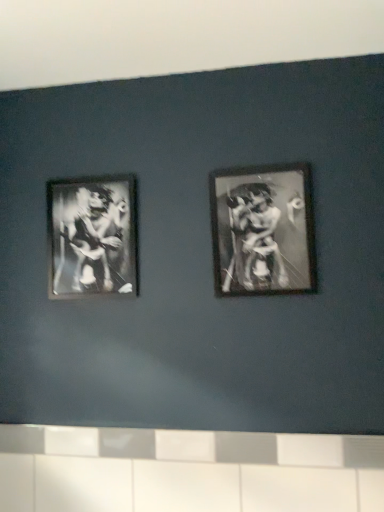
Question: Considering the relative positions of metallic silver frame at left, positioned as the 2th picture frame in right-to-left order, and white glossy tile at lower center in the image provided, is metallic silver frame at left, positioned as the 2th picture frame in right-to-left order, to the left of white glossy tile at lower center from the viewer's perspective?

Choices:
 (A) no
 (B) yes

Answer: (B)

Question: Is metallic silver frame at left, positioned as the 2th picture frame in right-to-left order, touching white glossy tile at lower center?

Choices:
 (A) no
 (B) yes

Answer: (A)

Question: Does metallic silver frame at left, which is the 2th picture frame from front to back, come in front of white glossy tile at lower center?

Choices:
 (A) yes
 (B) no

Answer: (B)

Question: From the image's perspective, is metallic silver frame at left, which appears as the first picture frame when viewed from the back, over white glossy tile at lower center?

Choices:
 (A) yes
 (B) no

Answer: (A)

Question: From a real-world perspective, is metallic silver frame at left, which appears as the first picture frame when viewed from the back, below white glossy tile at lower center?

Choices:
 (A) yes
 (B) no

Answer: (B)

Question: Does metallic silver frame at left, which is the 2th picture frame from front to back, turn towards white glossy tile at lower center?

Choices:
 (A) yes
 (B) no

Answer: (B)

Question: Can you confirm if metallic silver frame at center right, the 2th picture frame viewed from the left, is taller than white glossy tile at lower center?

Choices:
 (A) no
 (B) yes

Answer: (B)

Question: Is metallic silver frame at center right, the 2th picture frame viewed from the left, closer to the viewer compared to white glossy tile at lower center?

Choices:
 (A) yes
 (B) no

Answer: (B)

Question: Is metallic silver frame at center right, which ranks as the 2th picture frame in back-to-front order, located outside white glossy tile at lower center?

Choices:
 (A) no
 (B) yes

Answer: (B)

Question: Is metallic silver frame at center right, the 2th picture frame viewed from the left, smaller than white glossy tile at lower center?

Choices:
 (A) yes
 (B) no

Answer: (A)

Question: Is metallic silver frame at center right, which ranks as the 1th picture frame in right-to-left order, looking in the opposite direction of white glossy tile at lower center?

Choices:
 (A) yes
 (B) no

Answer: (B)

Question: Is metallic silver frame at center right, arranged as the first picture frame when viewed from the front, not near white glossy tile at lower center?

Choices:
 (A) no
 (B) yes

Answer: (A)

Question: Can you confirm if metallic silver frame at center right, which ranks as the 1th picture frame in right-to-left order, is shorter than metallic silver frame at left, marked as the 1th picture frame in a left-to-right arrangement?

Choices:
 (A) yes
 (B) no

Answer: (B)